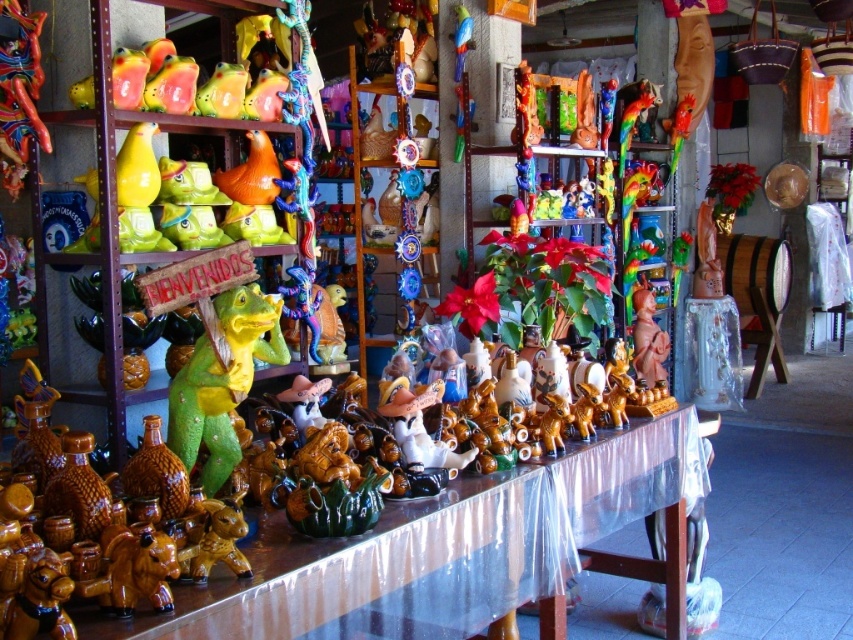
Question: Among these points, which one is nearest to the camera?

Choices:
 (A) (224, 332)
 (B) (624, 554)

Answer: (A)

Question: Does matte ceramic table at center have a larger size compared to green matte dinosaur at center?

Choices:
 (A) no
 (B) yes

Answer: (B)

Question: Is matte ceramic table at center thinner than green matte dinosaur at center?

Choices:
 (A) no
 (B) yes

Answer: (A)

Question: Which point is closer to the camera?

Choices:
 (A) (386, 568)
 (B) (273, 355)

Answer: (A)

Question: Is matte ceramic table at center thinner than green matte dinosaur at center?

Choices:
 (A) no
 (B) yes

Answer: (A)